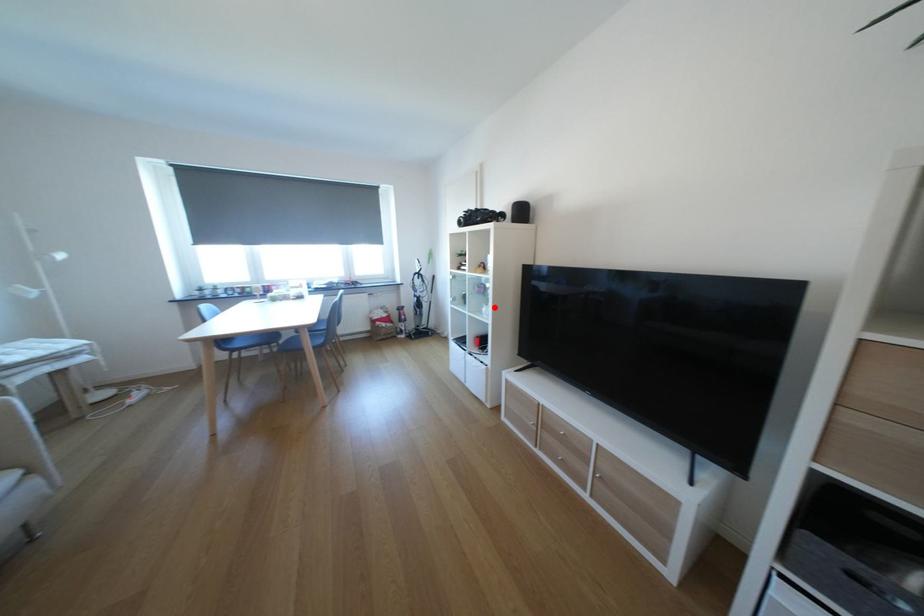
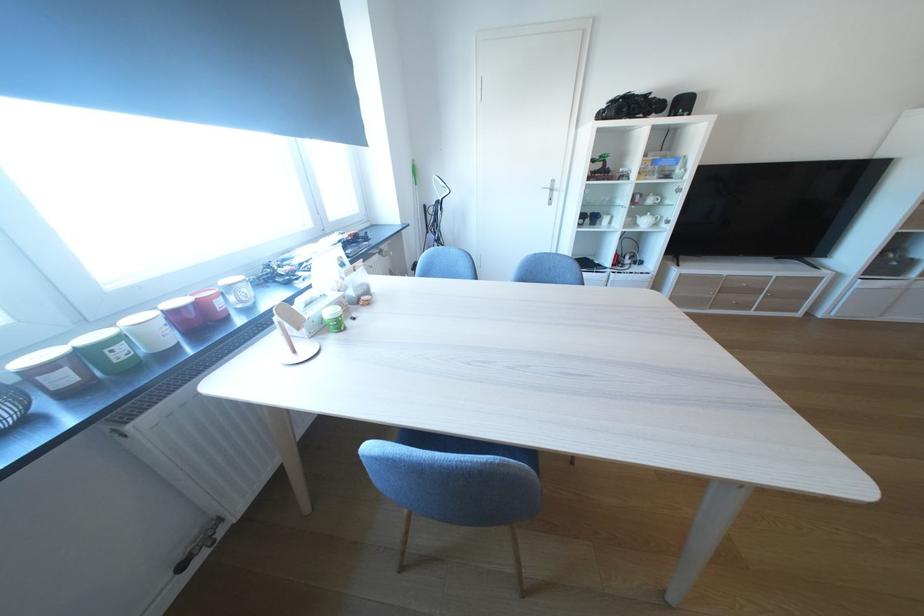
Where in the second image is the point corresponding to the highlighted location from the first image?

(648, 220)